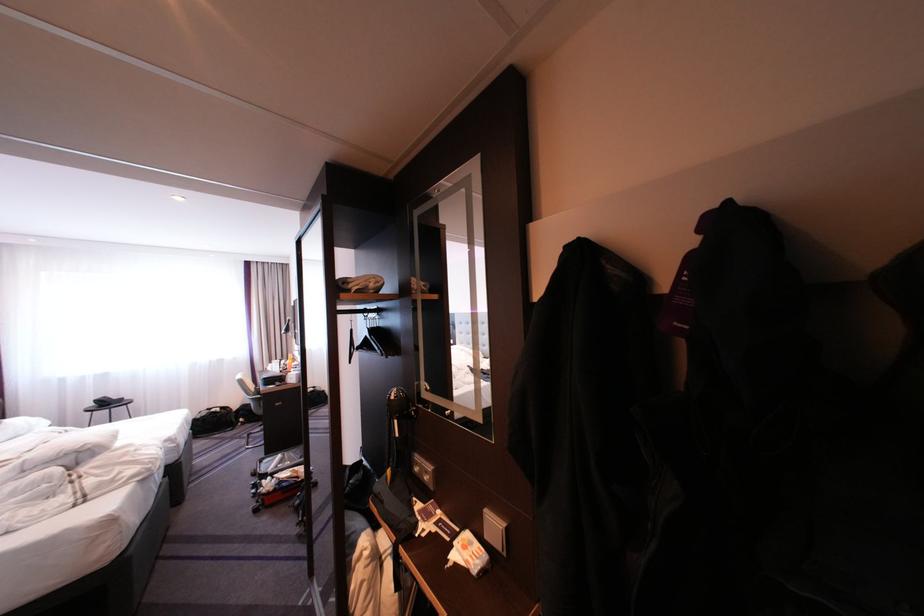
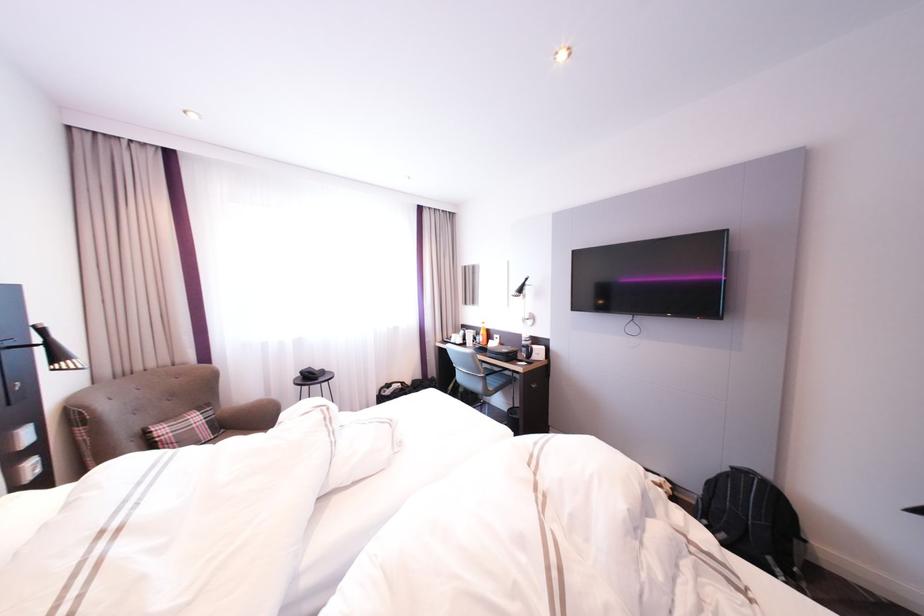
In the second image, find the point that corresponds to [261,395] in the first image.

(492, 373)